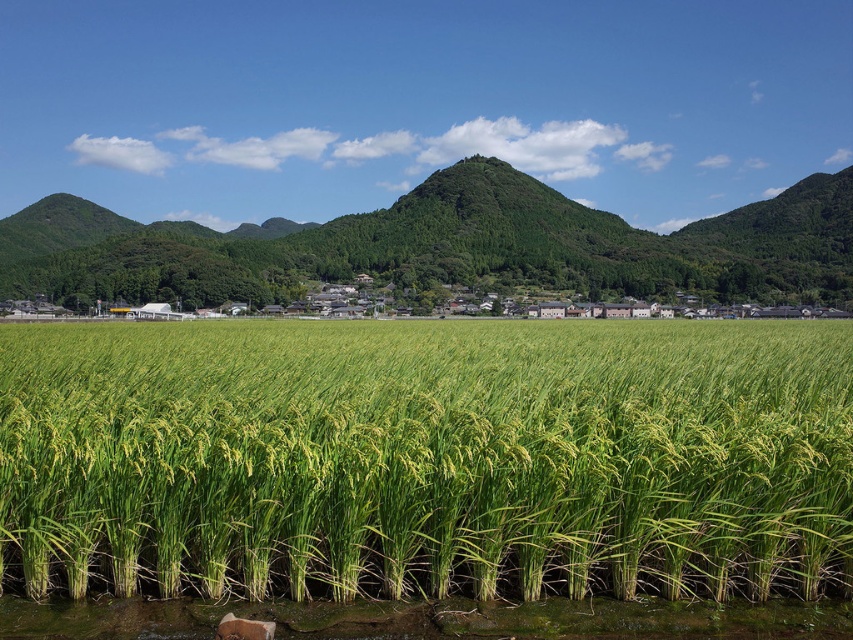
Question: Among these points, which one is farthest from the camera?

Choices:
 (A) (296, 256)
 (B) (616, 390)

Answer: (A)

Question: Is green grassy rice field at center thinner than green grassy hill at center?

Choices:
 (A) yes
 (B) no

Answer: (A)

Question: Which object appears farthest from the camera in this image?

Choices:
 (A) green grassy rice field at center
 (B) green grassy hill at center

Answer: (B)

Question: Which point is closer to the camera?

Choices:
 (A) (413, 339)
 (B) (477, 221)

Answer: (A)

Question: Does green grassy rice field at center appear on the right side of green grassy hill at center?

Choices:
 (A) no
 (B) yes

Answer: (A)

Question: Can you confirm if green grassy rice field at center is smaller than green grassy hill at center?

Choices:
 (A) yes
 (B) no

Answer: (A)